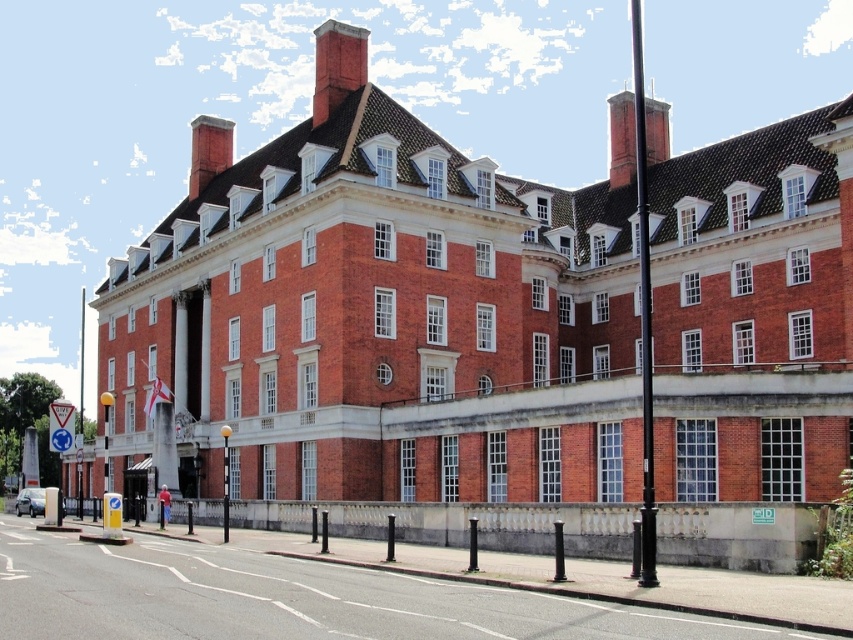
Between red brick chimney at upper center and smooth brick chimney at upper center, which one is positioned lower?

smooth brick chimney at upper center

Who is positioned more to the right, red brick chimney at upper center or smooth brick chimney at upper center?

red brick chimney at upper center is more to the right.

Describe the element at coordinates (337, 65) in the screenshot. I see `red brick chimney at upper center` at that location.

The image size is (853, 640). What are the coordinates of `red brick chimney at upper center` in the screenshot? It's located at (337, 65).

Can you confirm if red brick chimney at upper right is positioned to the left of smooth brick chimney at upper center?

No, red brick chimney at upper right is not to the left of smooth brick chimney at upper center.

Can you confirm if red brick chimney at upper right is smaller than smooth brick chimney at upper center?

Yes, red brick chimney at upper right is smaller than smooth brick chimney at upper center.

Does point (669, 134) come behind point (218, 122)?

No, (669, 134) is in front of (218, 122).

Find the location of a particular element. This screenshot has height=640, width=853. red brick chimney at upper right is located at coordinates (621, 138).

Does red brick chimney at upper center appear under red brick chimney at upper right?

Incorrect, red brick chimney at upper center is not positioned below red brick chimney at upper right.

Who is more forward, (335, 92) or (619, 122)?

Point (335, 92) is in front.

You are a GUI agent. You are given a task and a screenshot of the screen. Output one action in this format:
    pyautogui.click(x=<x>, y=<y>)
    Task: Click on the red brick chimney at upper center
    Image resolution: width=853 pixels, height=640 pixels.
    Given the screenshot: What is the action you would take?
    pyautogui.click(x=337, y=65)